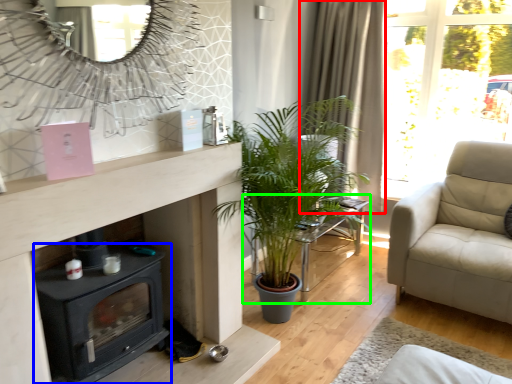
Question: Which object is the farthest from curtain (highlighted by a red box)? Choose among these: wood burning stove (highlighted by a blue box) or table (highlighted by a green box).

Choices:
 (A) wood burning stove
 (B) table

Answer: (A)